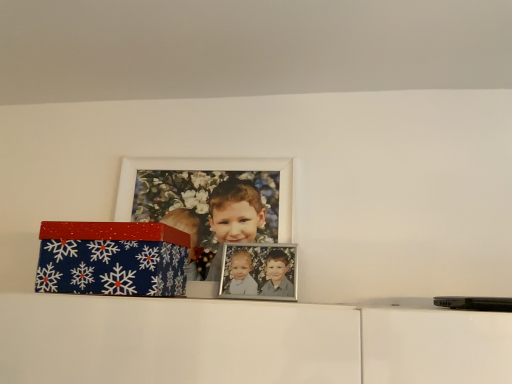
Question: From a real-world perspective, is white matte picture frame at upper center positioned above or below blue glittery box at left?

Choices:
 (A) above
 (B) below

Answer: (A)

Question: Considering the positions of white matte picture frame at upper center and blue glittery box at left in the image, is white matte picture frame at upper center taller or shorter than blue glittery box at left?

Choices:
 (A) short
 (B) tall

Answer: (B)

Question: In the image, is white matte picture frame at upper center on the left side or the right side of blue glittery box at left?

Choices:
 (A) right
 (B) left

Answer: (A)

Question: Is point (91, 243) closer or farther from the camera than point (242, 165)?

Choices:
 (A) farther
 (B) closer

Answer: (B)

Question: Relative to white matte picture frame at upper center, is blue glittery box at left in front or behind?

Choices:
 (A) behind
 (B) front

Answer: (B)

Question: Is blue glittery box at left bigger or smaller than white matte picture frame at upper center?

Choices:
 (A) small
 (B) big

Answer: (B)

Question: From the image's perspective, is blue glittery box at left above or below white matte picture frame at upper center?

Choices:
 (A) above
 (B) below

Answer: (B)